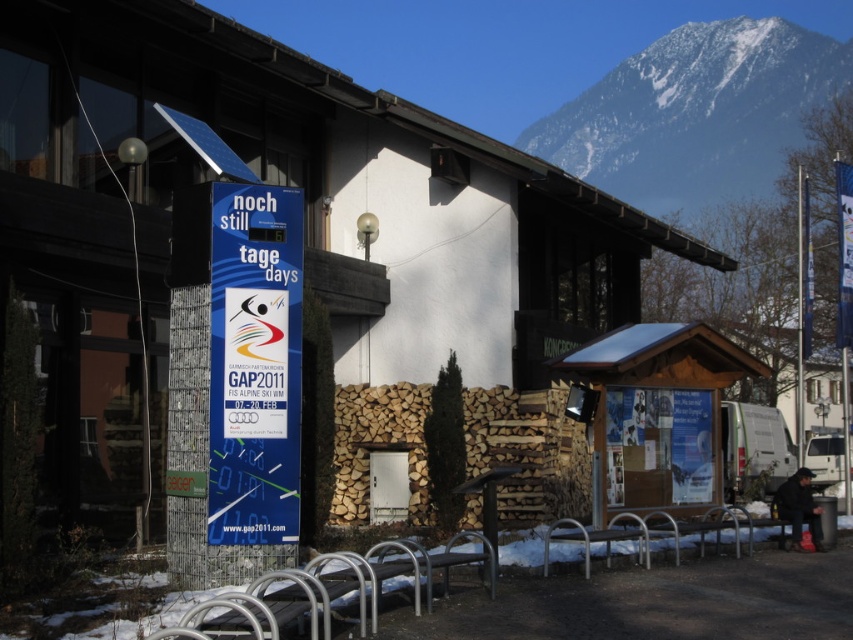
Is point (711, 40) closer to camera compared to point (260, 522)?

No, it is behind (260, 522).

Find the location of a particular element. snowy granite mountain at upper right is located at coordinates (695, 112).